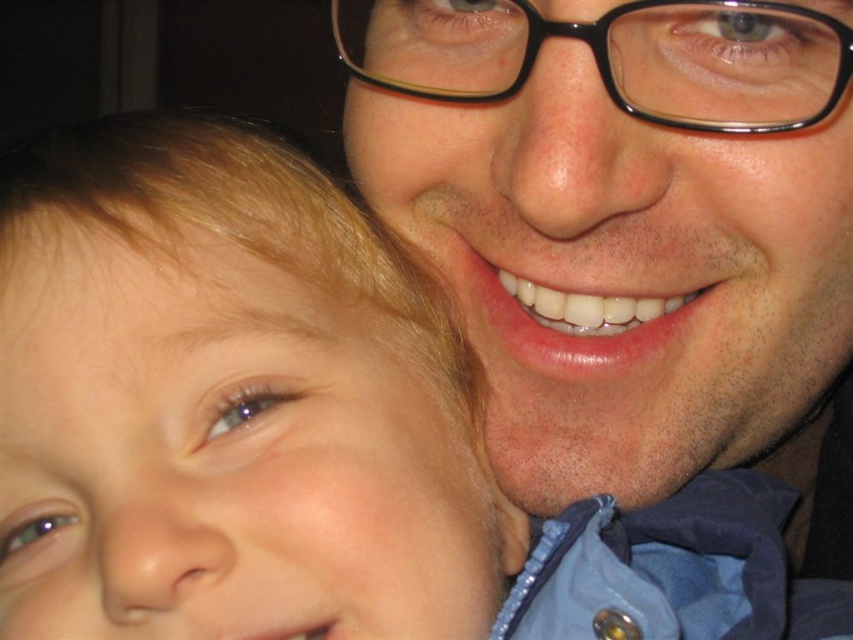
Which is behind, point (612, 572) or point (474, 596)?

Positioned behind is point (474, 596).

Is smooth skin face at upper right positioned in front of smooth blonde hair at left?

No.

Does point (531, 513) come closer to viewer compared to point (228, 259)?

No, it is not.

You are a GUI agent. You are given a task and a screenshot of the screen. Output one action in this format:
    pyautogui.click(x=<x>, y=<y>)
    Task: Click on the smooth skin face at upper right
    Image resolution: width=853 pixels, height=640 pixels.
    Given the screenshot: What is the action you would take?
    pyautogui.click(x=631, y=282)